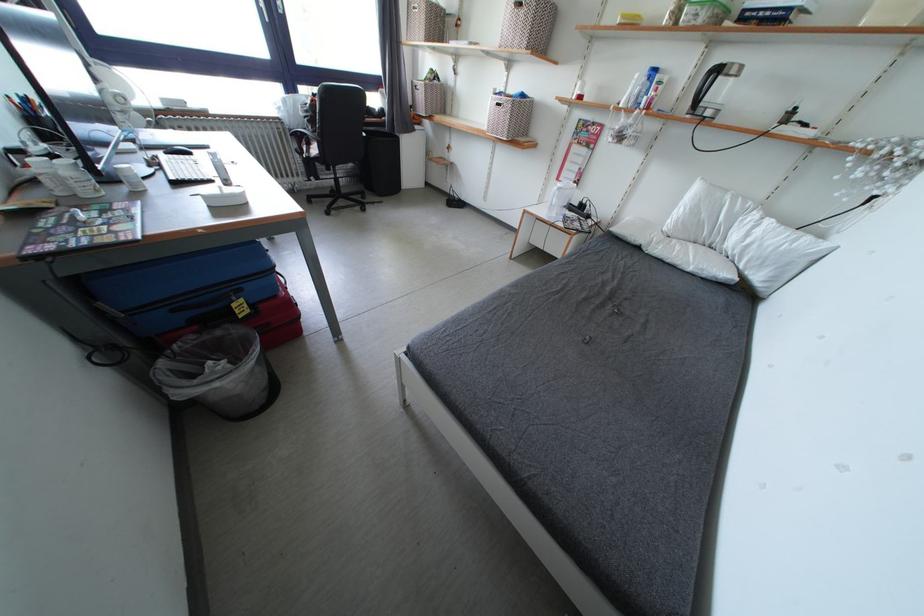
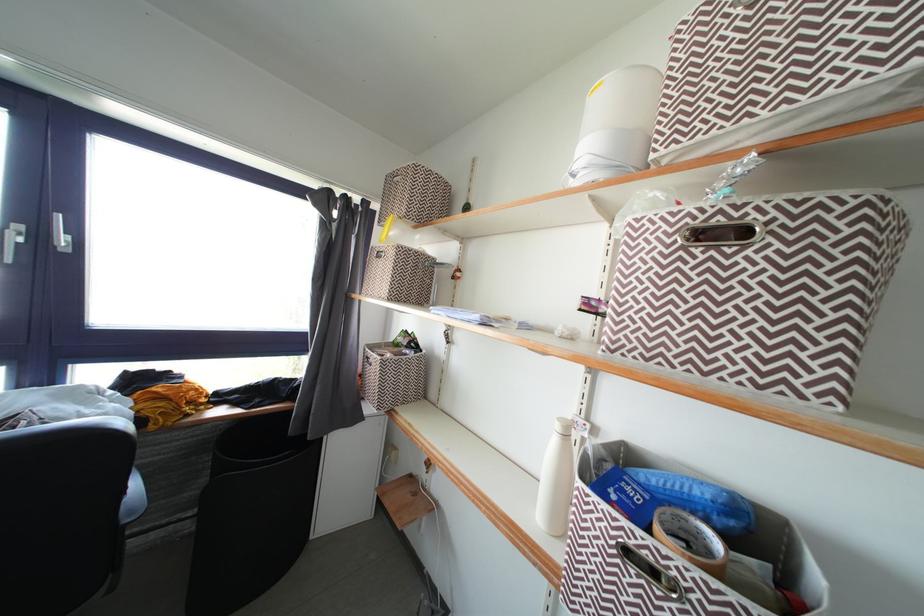
The point at (432, 90) is marked in the first image. Where is the corresponding point in the second image?

(390, 367)